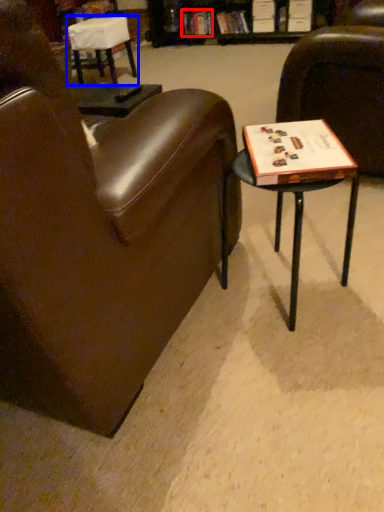
Question: Which of the following is the farthest to the observer, book (highlighted by a red box) or chair (highlighted by a blue box)?

Choices:
 (A) book
 (B) chair

Answer: (A)